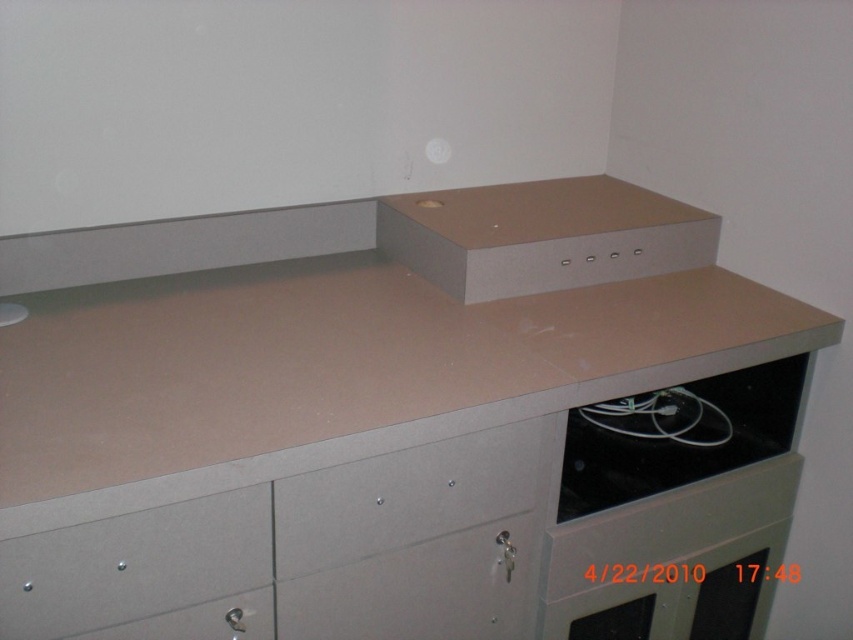
Question: Is the position of beige matte counter top at center more distant than that of metallic gray drawer at lower center?

Choices:
 (A) yes
 (B) no

Answer: (B)

Question: Does metallic gray drawer at lower left appear on the left side of black matte cable at lower right?

Choices:
 (A) yes
 (B) no

Answer: (A)

Question: Estimate the real-world distances between objects in this image. Which object is farther from the metallic gray drawer at lower left?

Choices:
 (A) metallic gray drawer at lower center
 (B) beige matte counter top at center
 (C) black matte cable at lower right

Answer: (C)

Question: Estimate the real-world distances between objects in this image. Which object is farther from the beige matte counter top at center?

Choices:
 (A) metallic gray drawer at lower left
 (B) black matte cable at lower right
 (C) metallic gray drawer at lower center

Answer: (B)

Question: In this image, where is metallic gray drawer at lower center located relative to metallic gray drawer at lower left?

Choices:
 (A) above
 (B) below

Answer: (A)

Question: Estimate the real-world distances between objects in this image. Which object is farther from the black matte cable at lower right?

Choices:
 (A) beige matte counter top at center
 (B) metallic gray drawer at lower center
 (C) metallic gray drawer at lower left

Answer: (C)